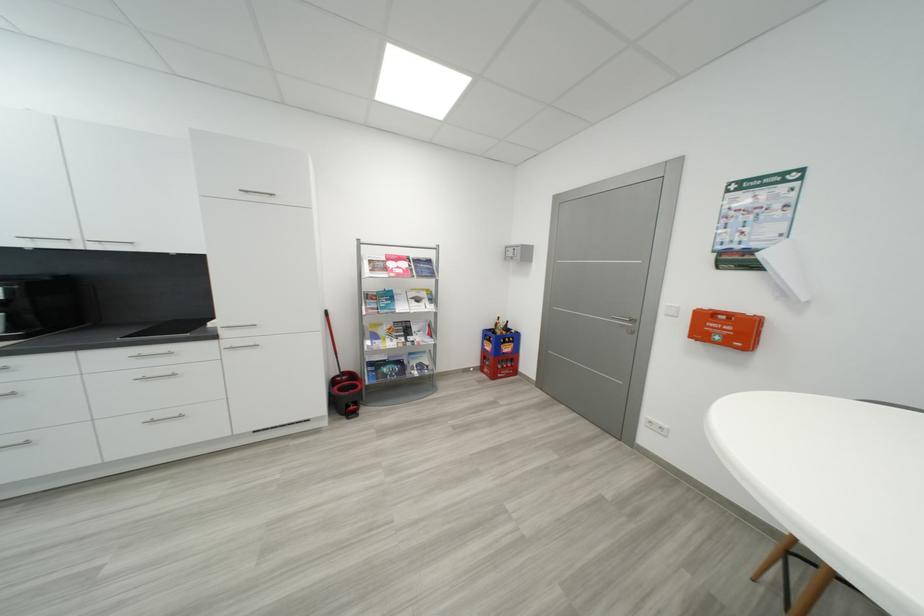
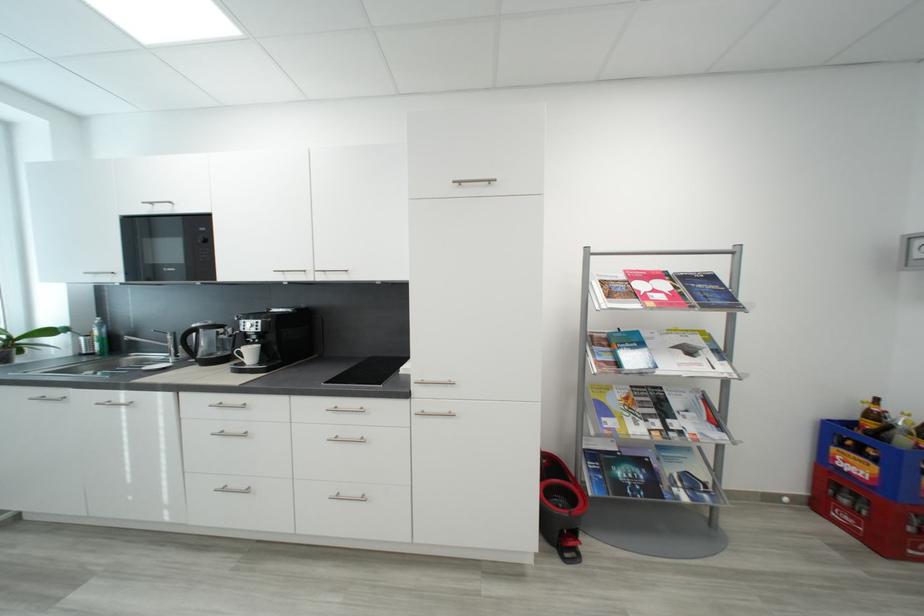
The point at (495, 342) is marked in the first image. Where is the corresponding point in the second image?

(867, 454)